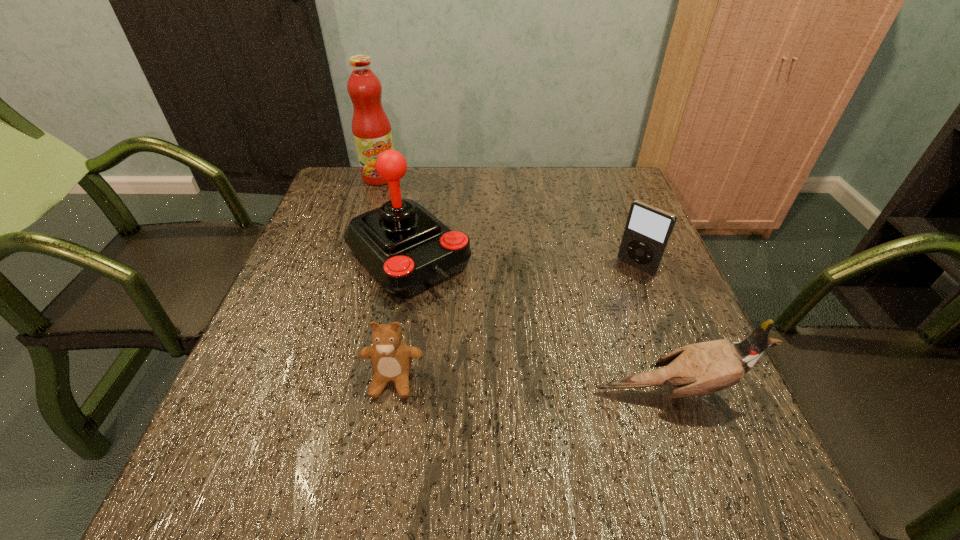
You are a GUI agent. You are given a task and a screenshot of the screen. Output one action in this format:
    pyautogui.click(x=<x>, y=<y>)
    Task: Click on the joystick that is at the left edge
    
    Given the screenshot: What is the action you would take?
    pyautogui.click(x=409, y=250)

Where is `bird located at the right edge`? This screenshot has height=540, width=960. bird located at the right edge is located at coordinates (697, 369).

Image resolution: width=960 pixels, height=540 pixels. In order to click on iPod present at the right edge in this screenshot , I will do `click(648, 229)`.

Find the location of `object present at the far left corner`. object present at the far left corner is located at coordinates (371, 128).

Identify the location of object present at the near right corner. The image size is (960, 540). (697, 369).

This screenshot has width=960, height=540. In order to click on vacant space at the far edge of the desktop in this screenshot , I will do `click(499, 198)`.

Locate an element on the screen. free region at the near edge is located at coordinates (341, 396).

Where is `vacant point at the left edge`? The width and height of the screenshot is (960, 540). vacant point at the left edge is located at coordinates (302, 254).

In the image, there is a desktop. Find the location of `free space at the right edge`. free space at the right edge is located at coordinates (717, 393).

The width and height of the screenshot is (960, 540). In order to click on free point at the far left corner in this screenshot , I will do `click(335, 183)`.